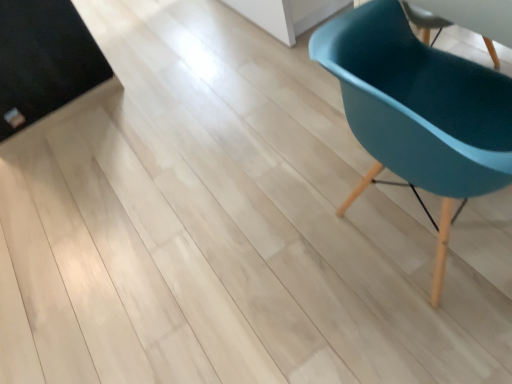
In order to face teal plastic chair at right, should I rotate leftwards or rightwards?

To face it directly, rotate right by 23.232 degrees.

This screenshot has width=512, height=384. I want to click on teal plastic chair at right, so click(x=418, y=111).

The height and width of the screenshot is (384, 512). Describe the element at coordinates (418, 111) in the screenshot. I see `teal plastic chair at right` at that location.

The image size is (512, 384). Find the location of `teal plastic chair at right`. teal plastic chair at right is located at coordinates (418, 111).